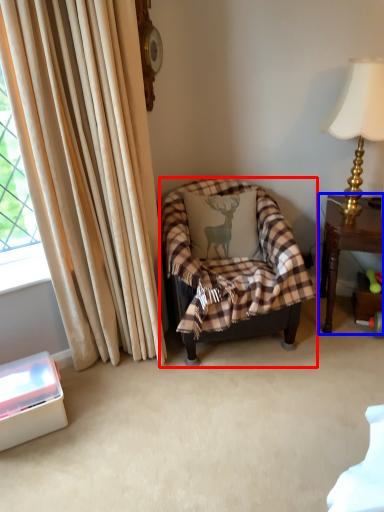
Question: Which object appears closest to the camera in this image, chair (highlighted by a red box) or table (highlighted by a blue box)?

Choices:
 (A) chair
 (B) table

Answer: (A)